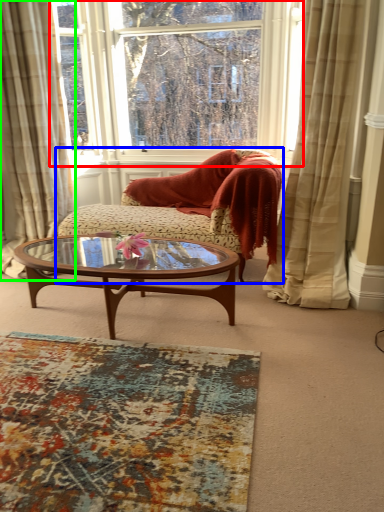
Question: Estimate the real-world distances between objects in this image. Which object is closer to window (highlighted by a red box), studio couch (highlighted by a blue box) or curtain (highlighted by a green box)?

Choices:
 (A) studio couch
 (B) curtain

Answer: (B)